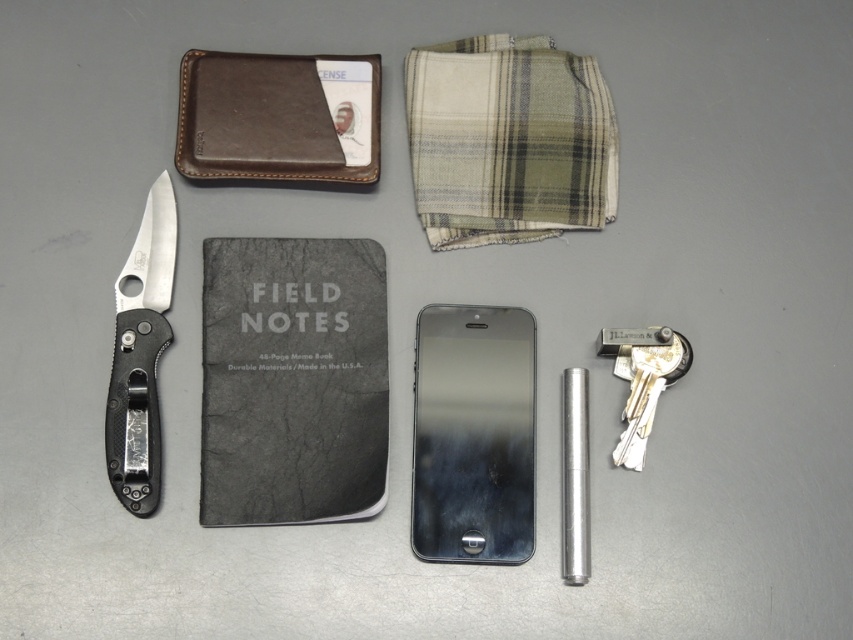
You are trying to place both the metallic silver phone at center and the polished silver blade at left into a rectangular case that can only accommodate items up to the width of the wider object. Which object determines the minimum required width of the case?

The metallic silver phone at center determines the minimum required width of the case because it might be wider than the polished silver blade at left.